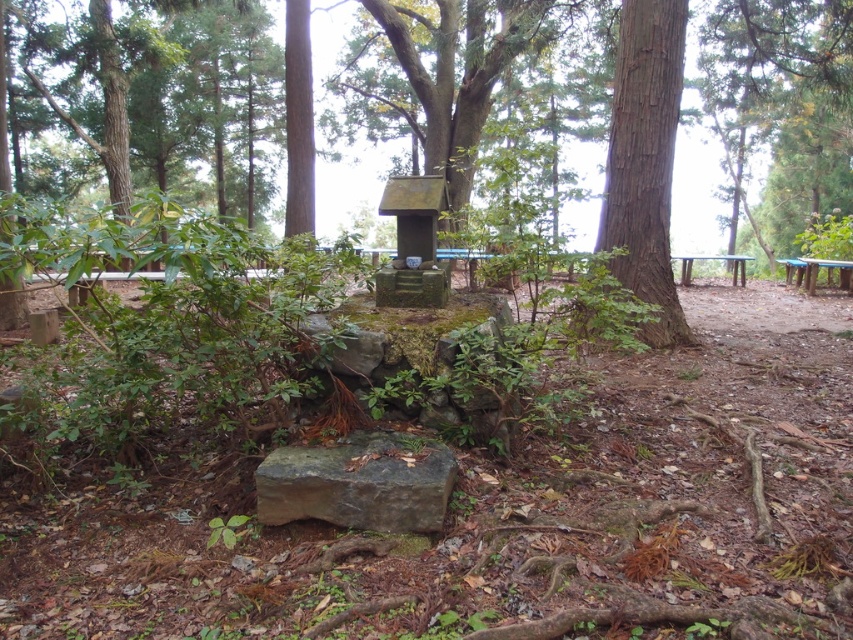
Question: Which of these objects is positioned farthest from the wooden picnic table at right?

Choices:
 (A) gray rough stone at center
 (B) blue plastic picnic table at right
 (C) smooth brown tree trunk at right

Answer: (A)

Question: Which point is farther to the camera?

Choices:
 (A) blue plastic picnic table at right
 (B) wooden picnic table at right
 (C) gray rough stone at center

Answer: (B)

Question: Estimate the real-world distances between objects in this image. Which object is closer to the smooth brown tree trunk at right?

Choices:
 (A) gray rough stone at center
 (B) blue plastic picnic table at right

Answer: (A)

Question: Does smooth brown tree trunk at right have a smaller size compared to gray rough stone at center?

Choices:
 (A) yes
 (B) no

Answer: (B)

Question: Does blue plastic picnic table at right appear on the right side of wooden picnic table at right?

Choices:
 (A) no
 (B) yes

Answer: (B)

Question: Can you confirm if gray rough stone at center is positioned to the right of wooden picnic table at right?

Choices:
 (A) no
 (B) yes

Answer: (A)